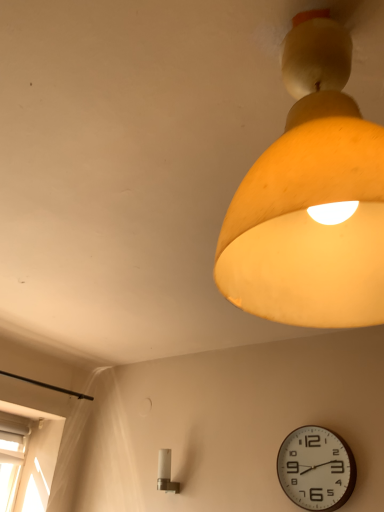
Question: Is white glossy light fixture at lower center, placed as the second lamp when sorted from front to back, surrounded by matte yellow lampshade at upper right, the first lamp from the top?

Choices:
 (A) yes
 (B) no

Answer: (B)

Question: Is matte yellow lampshade at upper right, which is the second lamp in left-to-right order, positioned in front of white glossy light fixture at lower center, which is counted as the 1th lamp, starting from the left?

Choices:
 (A) no
 (B) yes

Answer: (B)

Question: Is matte yellow lampshade at upper right, positioned as the second lamp in back-to-front order, positioned behind white glossy light fixture at lower center, which appears as the 1th lamp when ordered from the bottom?

Choices:
 (A) yes
 (B) no

Answer: (B)

Question: Is matte yellow lampshade at upper right, the first lamp from the top, next to white glossy light fixture at lower center, which is the 1th lamp in back-to-front order?

Choices:
 (A) no
 (B) yes

Answer: (A)

Question: Is matte yellow lampshade at upper right, positioned as the second lamp in back-to-front order, wider than white glossy light fixture at lower center, which is counted as the 1th lamp, starting from the left?

Choices:
 (A) no
 (B) yes

Answer: (B)

Question: From the image's perspective, is white plastic clock at lower right above or below matte yellow lampshade at upper right, which is the second lamp in left-to-right order?

Choices:
 (A) above
 (B) below

Answer: (B)

Question: In terms of width, does white plastic clock at lower right look wider or thinner when compared to matte yellow lampshade at upper right, the first lamp from the top?

Choices:
 (A) thin
 (B) wide

Answer: (A)

Question: Considering the positions of white plastic clock at lower right and matte yellow lampshade at upper right, the 1th lamp in the right-to-left sequence, in the image, is white plastic clock at lower right taller or shorter than matte yellow lampshade at upper right, the 1th lamp in the right-to-left sequence,?

Choices:
 (A) short
 (B) tall

Answer: (A)

Question: Based on their sizes in the image, would you say white plastic clock at lower right is bigger or smaller than matte yellow lampshade at upper right, the 1th lamp in the right-to-left sequence?

Choices:
 (A) big
 (B) small

Answer: (B)

Question: Is white glossy light fixture at lower center, placed as the second lamp when sorted from front to back, inside the boundaries of white plastic clock at lower right, or outside?

Choices:
 (A) inside
 (B) outside

Answer: (B)

Question: From the image's perspective, relative to white plastic clock at lower right, is white glossy light fixture at lower center, which appears as the 1th lamp when ordered from the bottom, above or below?

Choices:
 (A) below
 (B) above

Answer: (A)

Question: From a real-world perspective, relative to white plastic clock at lower right, is white glossy light fixture at lower center, which is the 1th lamp in back-to-front order, vertically above or below?

Choices:
 (A) below
 (B) above

Answer: (A)

Question: Considering their positions, is white glossy light fixture at lower center, which appears as the 1th lamp when ordered from the bottom, located in front of or behind white plastic clock at lower right?

Choices:
 (A) behind
 (B) front

Answer: (A)

Question: Is white plastic clock at lower right taller or shorter than white glossy light fixture at lower center, which is counted as the 1th lamp, starting from the left?

Choices:
 (A) tall
 (B) short

Answer: (A)

Question: From the image's perspective, is white plastic clock at lower right above or below white glossy light fixture at lower center, which appears as the 1th lamp when ordered from the bottom?

Choices:
 (A) below
 (B) above

Answer: (B)